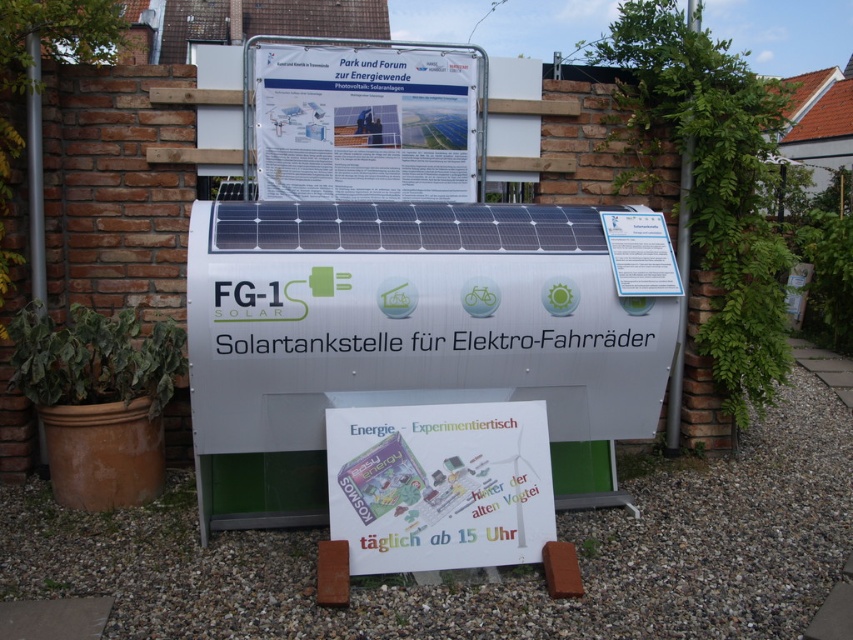
You are a tourist visiting the solar energy display and want to read the information on the white paper at upper center. Where should you look to find it?

The white paper at upper center is located at point (364, 124).